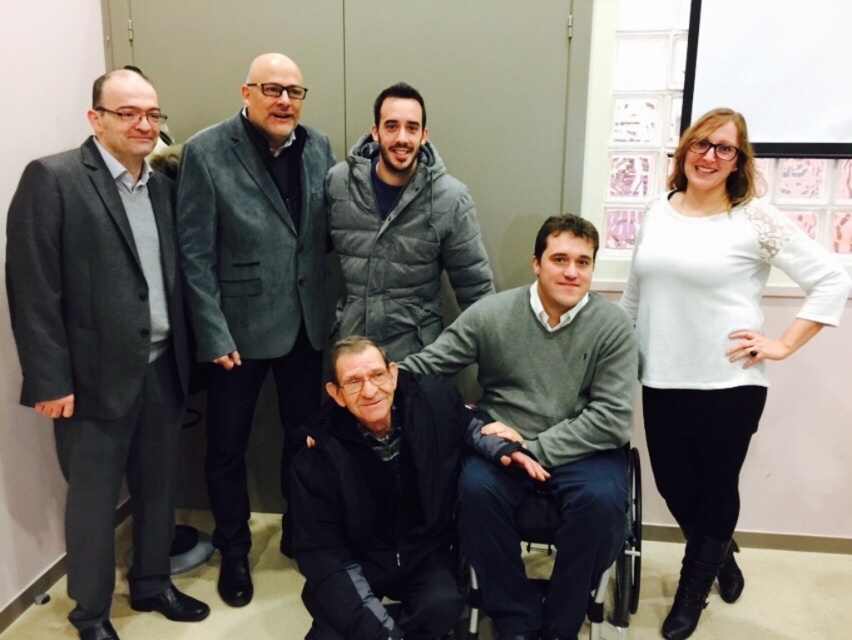
Question: Can you confirm if gray sweater at center is positioned below velvet blazer at upper left?

Choices:
 (A) no
 (B) yes

Answer: (B)

Question: Is gray sweater at center positioned in front of velvet blazer at upper left?

Choices:
 (A) yes
 (B) no

Answer: (A)

Question: Which point is closer to the camera taking this photo?

Choices:
 (A) (646, 221)
 (B) (338, 428)
 (C) (43, 392)
 (D) (548, 634)

Answer: (C)

Question: Among these points, which one is nearest to the camera?

Choices:
 (A) (629, 461)
 (B) (327, 580)
 (C) (470, 291)
 (D) (763, 342)

Answer: (B)

Question: Does velvet blazer at upper left have a larger size compared to black matte jacket at lower center?

Choices:
 (A) yes
 (B) no

Answer: (A)

Question: Among these points, which one is nearest to the camera?

Choices:
 (A) click(x=330, y=176)
 (B) click(x=522, y=515)
 (C) click(x=429, y=346)

Answer: (B)